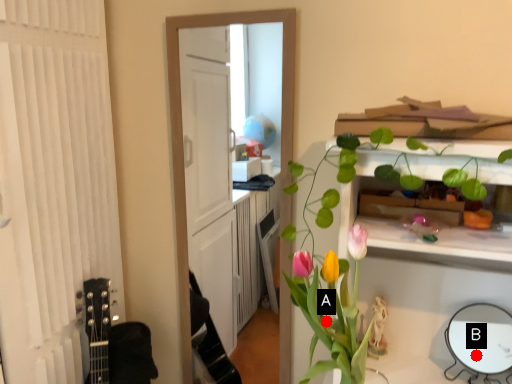
Question: Two points are circled on the image, labeled by A and B beside each circle. Which point is closer to the camera?

Choices:
 (A) A is closer
 (B) B is closer

Answer: (B)